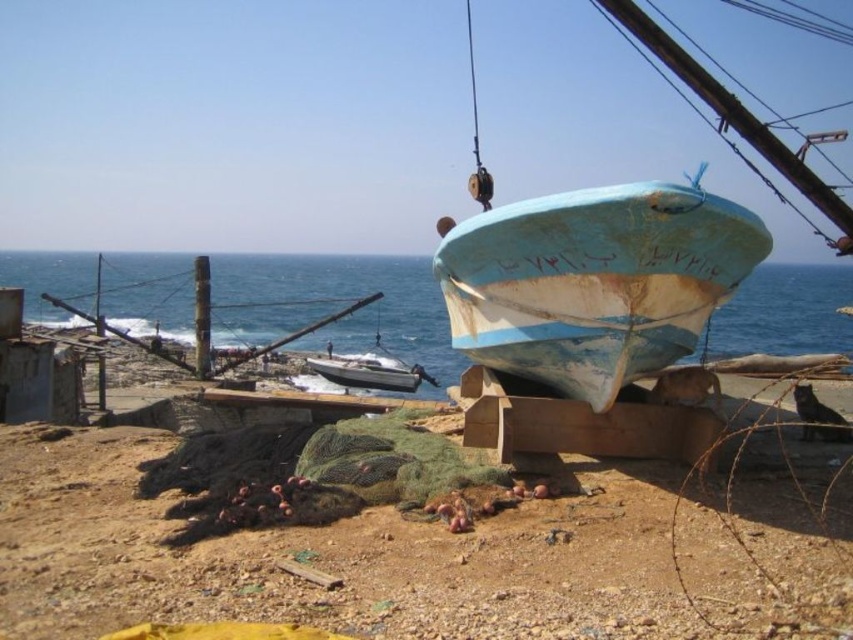
Question: Does rusty blue boat at center have a smaller size compared to white glossy boat at center?

Choices:
 (A) no
 (B) yes

Answer: (B)

Question: Which of the following is the closest to the observer?

Choices:
 (A) (134, 326)
 (B) (376, 362)
 (C) (589, 376)

Answer: (C)

Question: Which point is farther from the camera taking this photo?

Choices:
 (A) (524, 324)
 (B) (322, 371)
 (C) (103, 275)

Answer: (C)

Question: Which point is closer to the camera taking this photo?

Choices:
 (A) (677, 227)
 (B) (416, 337)
 (C) (387, 368)

Answer: (A)

Question: Can you confirm if rusty blue boat at center is positioned to the right of white glossy boat at center?

Choices:
 (A) no
 (B) yes

Answer: (B)

Question: Is the position of rusty blue boat at center more distant than that of white glossy boat at center?

Choices:
 (A) yes
 (B) no

Answer: (B)